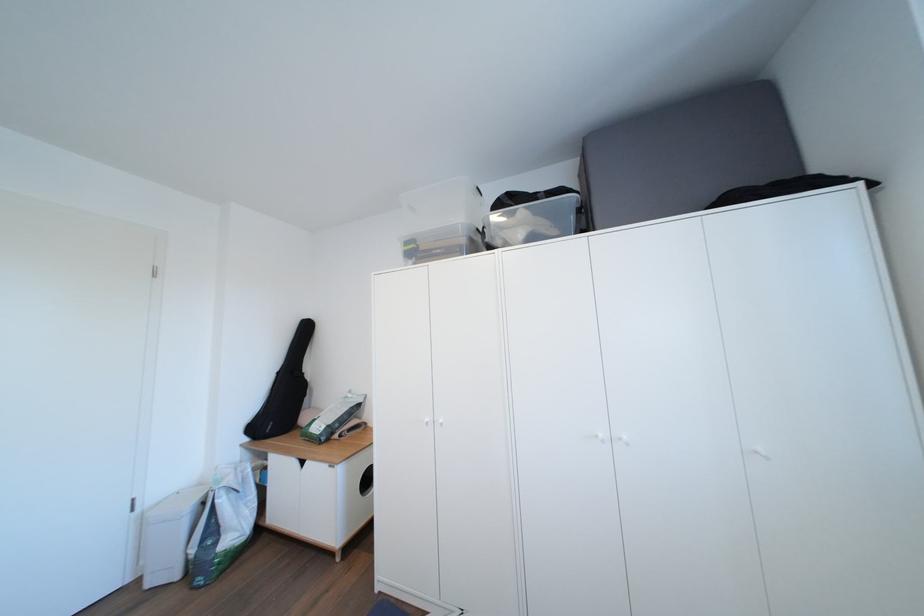
Where would you push the large gray cushion? Please return your answer as a coordinate pair (x, y).

(686, 154)